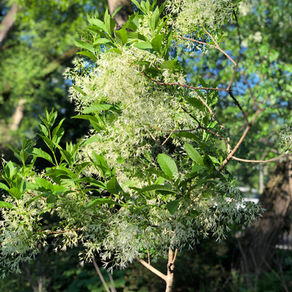
Where is `door`? The height and width of the screenshot is (292, 292). door is located at coordinates (228, 200).